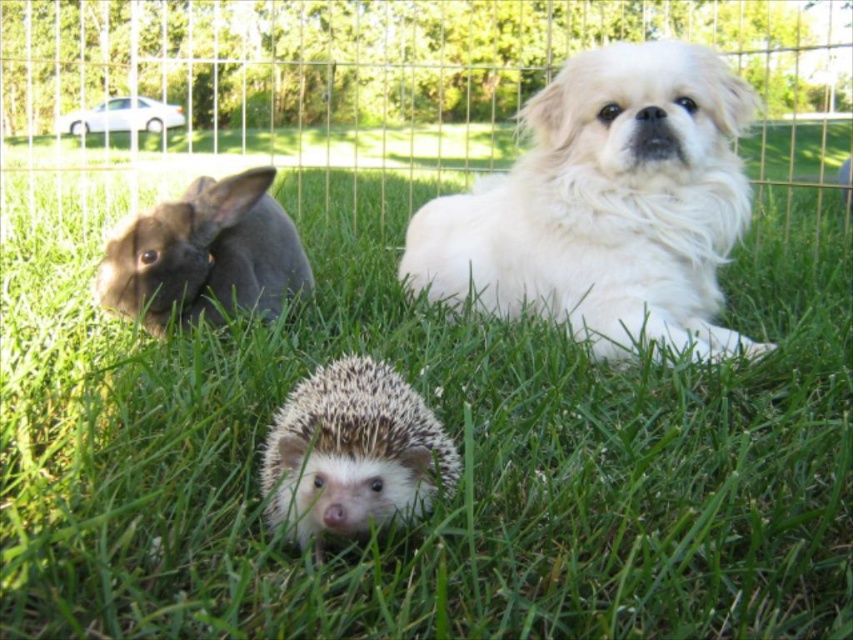
Does point (62, 84) come in front of point (283, 244)?

No, it is not.

Which is below, metallic wire fence at upper center or dark gray fur rabbit at left?

dark gray fur rabbit at left is below.

Locate an element on the screen. The height and width of the screenshot is (640, 853). metallic wire fence at upper center is located at coordinates (396, 80).

Which is above, white fluffy dog at center or white spiny hedgehog at center?

Positioned higher is white fluffy dog at center.

The width and height of the screenshot is (853, 640). What do you see at coordinates (606, 204) in the screenshot?
I see `white fluffy dog at center` at bounding box center [606, 204].

What do you see at coordinates (606, 204) in the screenshot? The height and width of the screenshot is (640, 853). I see `white fluffy dog at center` at bounding box center [606, 204].

Where is `white fluffy dog at center`? white fluffy dog at center is located at coordinates (606, 204).

At what (x,y) coordinates should I click in order to perform the action: click on metallic wire fence at upper center. Please return your answer as a coordinate pair (x, y). The width and height of the screenshot is (853, 640). Looking at the image, I should click on point(396,80).

Between metallic wire fence at upper center and white spiny hedgehog at center, which one is positioned lower?

white spiny hedgehog at center

Is point (71, 60) behind point (438, 452)?

Yes.

Locate an element on the screen. metallic wire fence at upper center is located at coordinates (396, 80).